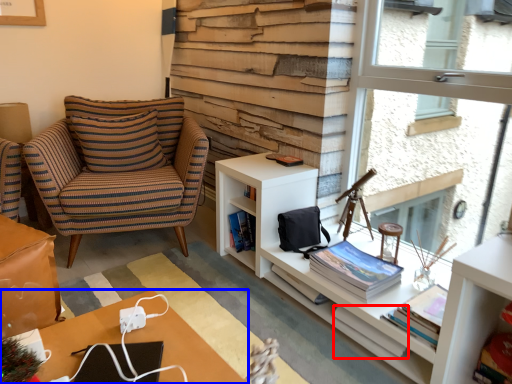
Question: Which object is further to the camera taking this photo, book (highlighted by a red box) or desk (highlighted by a blue box)?

Choices:
 (A) book
 (B) desk

Answer: (A)